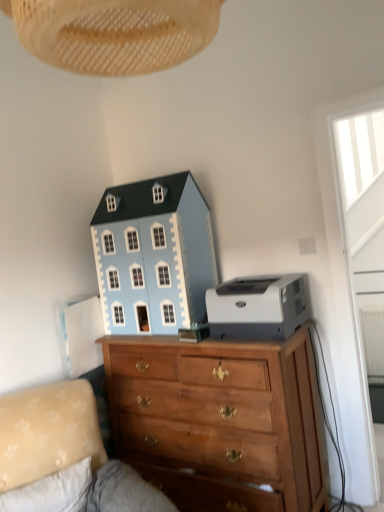
Question: Is light blue painted wood dollhouse at upper center bigger than wooden chest of drawers at center?

Choices:
 (A) yes
 (B) no

Answer: (B)

Question: Considering the relative positions of light blue painted wood dollhouse at upper center and wooden chest of drawers at center in the image provided, is light blue painted wood dollhouse at upper center to the right of wooden chest of drawers at center from the viewer's perspective?

Choices:
 (A) no
 (B) yes

Answer: (A)

Question: Does light blue painted wood dollhouse at upper center turn towards wooden chest of drawers at center?

Choices:
 (A) no
 (B) yes

Answer: (A)

Question: Is light blue painted wood dollhouse at upper center positioned in front of wooden chest of drawers at center?

Choices:
 (A) no
 (B) yes

Answer: (A)

Question: Is light blue painted wood dollhouse at upper center smaller than wooden chest of drawers at center?

Choices:
 (A) no
 (B) yes

Answer: (B)

Question: Is light blue painted wood dollhouse at upper center not close to wooden chest of drawers at center?

Choices:
 (A) yes
 (B) no

Answer: (B)

Question: Would you say wooden chest of drawers at center contains velvet beige couch at lower left?

Choices:
 (A) yes
 (B) no

Answer: (B)

Question: Considering the relative sizes of wooden chest of drawers at center and velvet beige couch at lower left in the image provided, is wooden chest of drawers at center shorter than velvet beige couch at lower left?

Choices:
 (A) no
 (B) yes

Answer: (A)

Question: From the image's perspective, is wooden chest of drawers at center over velvet beige couch at lower left?

Choices:
 (A) yes
 (B) no

Answer: (A)

Question: Is wooden chest of drawers at center to the right of velvet beige couch at lower left from the viewer's perspective?

Choices:
 (A) no
 (B) yes

Answer: (B)

Question: From the image's perspective, is wooden chest of drawers at center below velvet beige couch at lower left?

Choices:
 (A) no
 (B) yes

Answer: (A)

Question: Can you confirm if wooden chest of drawers at center is smaller than velvet beige couch at lower left?

Choices:
 (A) no
 (B) yes

Answer: (A)

Question: Does light blue painted wood dollhouse at upper center have a larger size compared to woven beige lampshade at upper center?

Choices:
 (A) yes
 (B) no

Answer: (A)